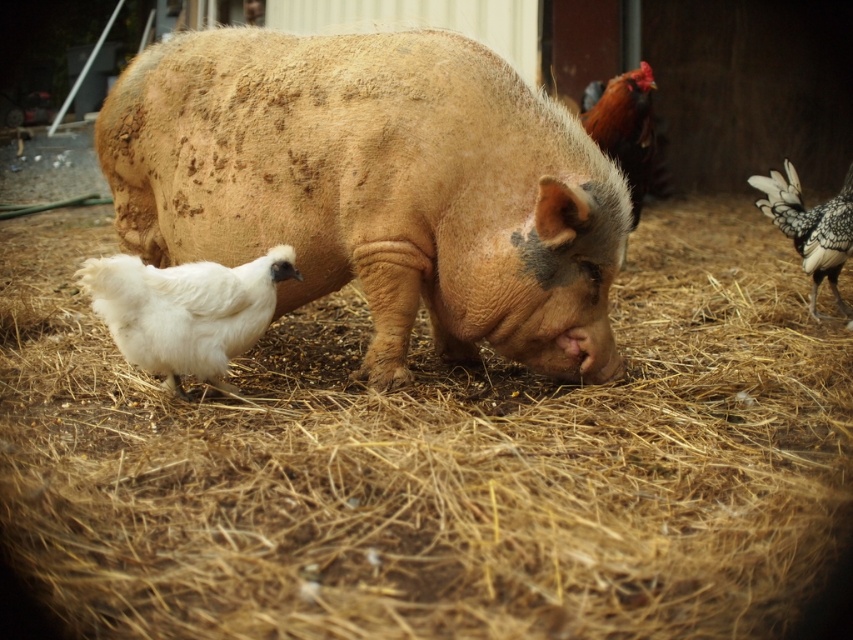
Question: Can you confirm if brown textured pig at center is positioned above white fluffy chicken at lower left?

Choices:
 (A) yes
 (B) no

Answer: (A)

Question: From the image, what is the correct spatial relationship of brown straw at center in relation to white fluffy chicken at lower left?

Choices:
 (A) left
 (B) right

Answer: (B)

Question: Which point is closer to the camera?

Choices:
 (A) (817, 234)
 (B) (558, 301)

Answer: (B)

Question: Based on their relative distances, which object is nearer to the white feathered chicken at right?

Choices:
 (A) white fluffy chicken at lower left
 (B) brown textured pig at center
 (C) brown straw at center

Answer: (C)

Question: Does white fluffy chicken at lower left appear over white feathered chicken at right?

Choices:
 (A) no
 (B) yes

Answer: (A)

Question: Which is nearer to the white fluffy chicken at lower left?

Choices:
 (A) brown textured pig at center
 (B) brown straw at center
 (C) white feathered chicken at right

Answer: (A)